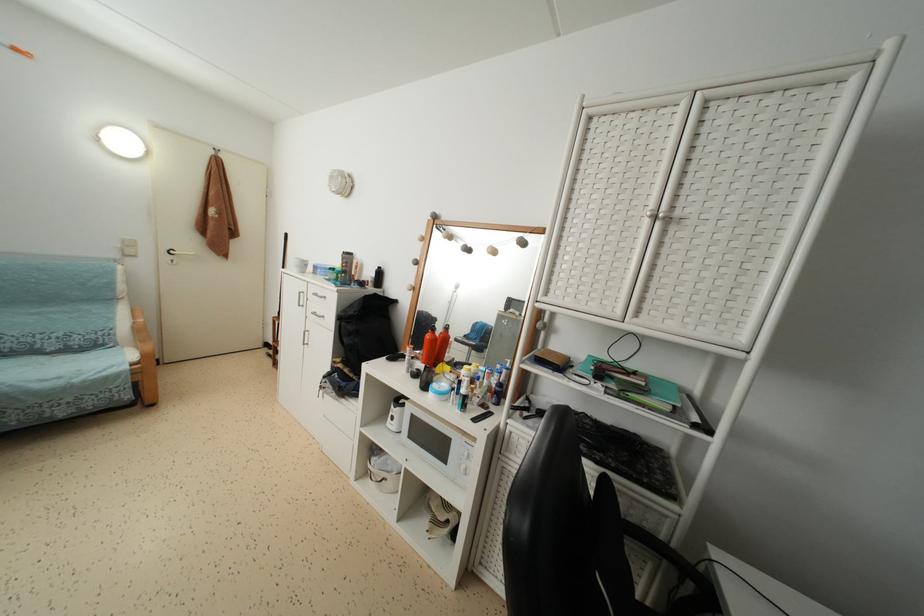
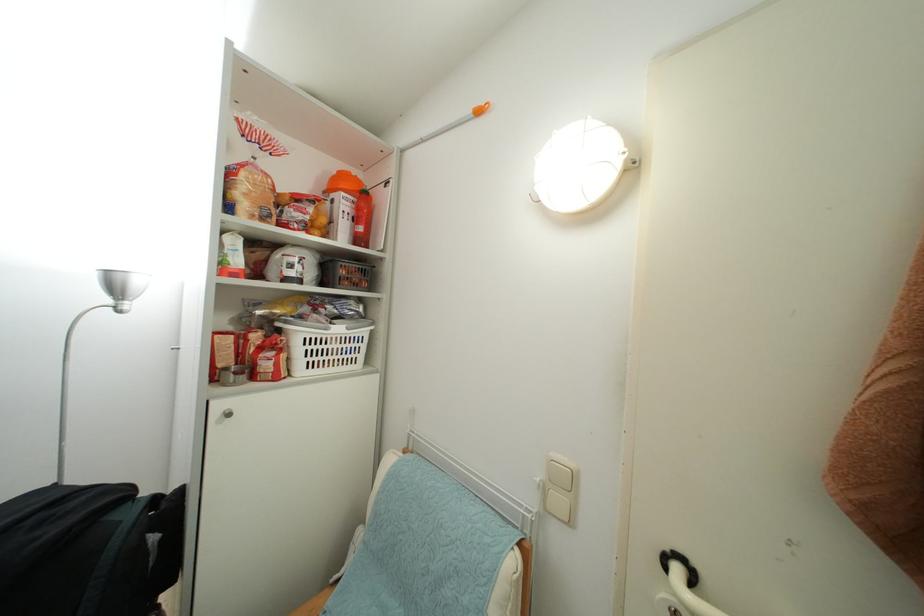
In the second image, find the point that corresponds to the point at 134,257 in the first image.

(563, 507)